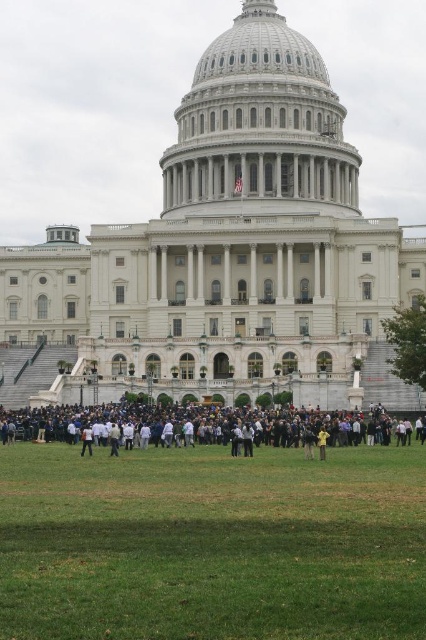
Between point (89, 456) and point (327, 433), which one is positioned behind?

The point (327, 433) is more distant.

Does white cotton shirt at lower center appear under yellow matte jacket at lower center?

Indeed, white cotton shirt at lower center is positioned under yellow matte jacket at lower center.

Measure the distance between white cotton shirt at lower center and camera.

white cotton shirt at lower center and camera are 61.37 meters apart from each other.

The height and width of the screenshot is (640, 426). What are the coordinates of `white cotton shirt at lower center` in the screenshot? It's located at (86, 440).

Between point (49, 436) and point (325, 452), which one is positioned in front?

Point (325, 452) is in front.

Between point (422, 422) and point (319, 442), which one is positioned in front?

Point (319, 442)

Where is `dark gray clothing at center`? The height and width of the screenshot is (640, 426). dark gray clothing at center is located at coordinates (298, 426).

Which is more to the left, white marble dome at center or white cotton shirt at lower center?

white cotton shirt at lower center is more to the left.

What do you see at coordinates (259, 125) in the screenshot?
I see `white marble dome at center` at bounding box center [259, 125].

You are a GUI agent. You are given a task and a screenshot of the screen. Output one action in this format:
    pyautogui.click(x=<x>, y=<y>)
    Task: Click on the white marble dome at center
    This screenshot has width=426, height=640.
    Given the screenshot: What is the action you would take?
    click(x=259, y=125)